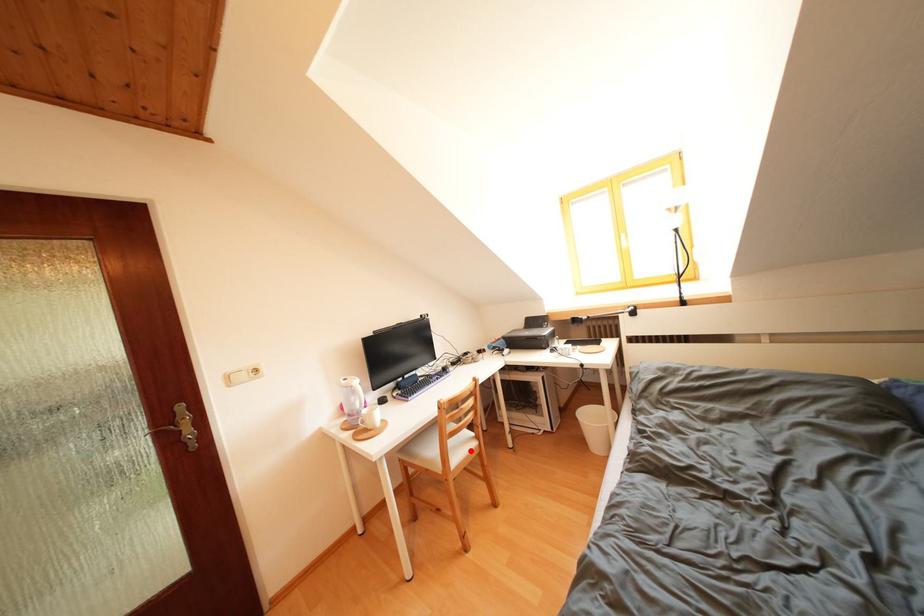
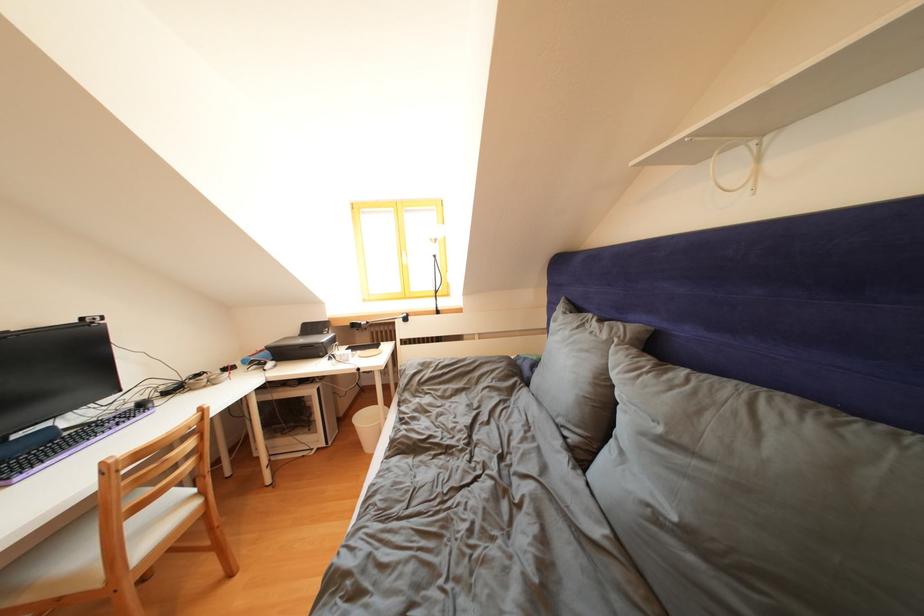
Find the pixel in the second image that matches the highlighted location in the first image.

(175, 522)